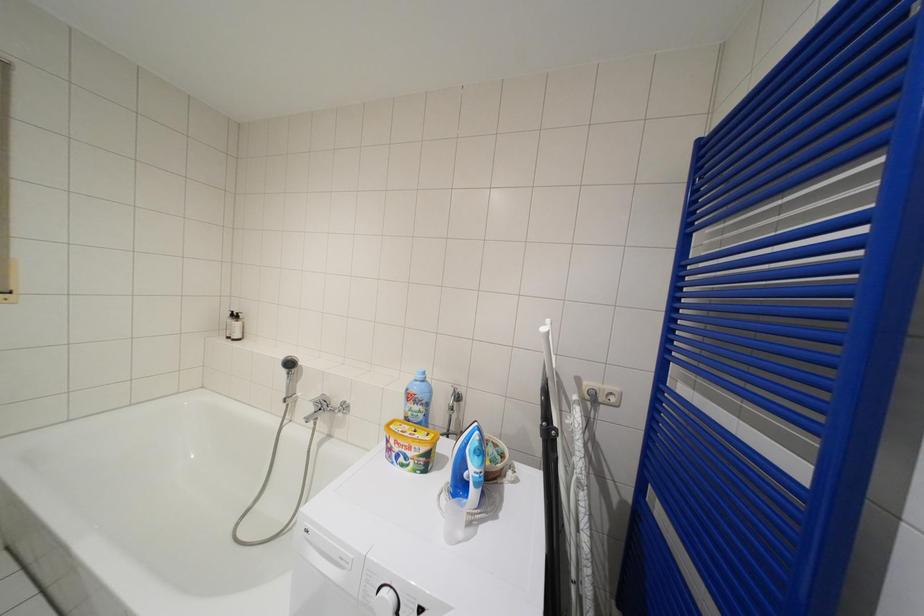
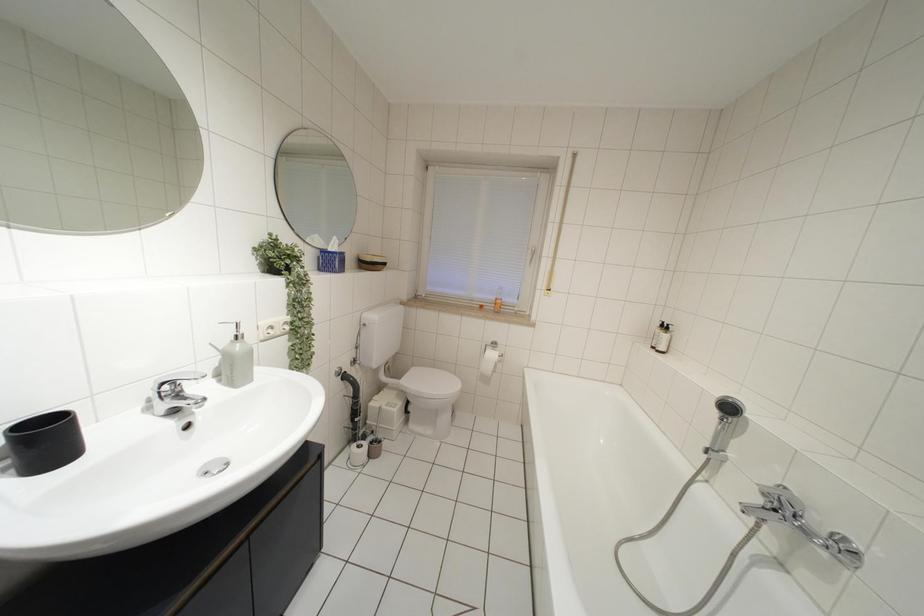
Question: The images are taken continuously from a first-person perspective. In which direction is your viewpoint rotating?

Choices:
 (A) Left
 (B) Right
 (C) Up
 (D) Down

Answer: (A)